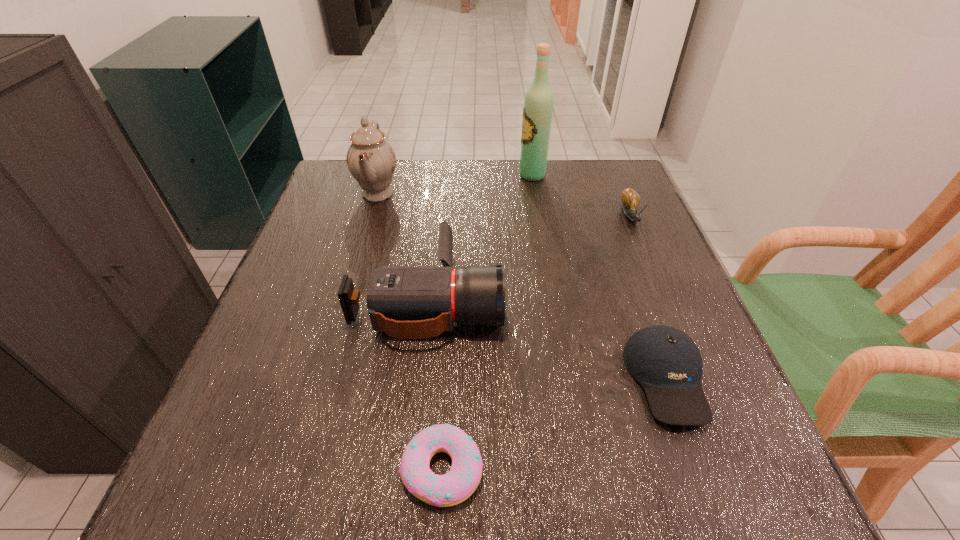
This screenshot has width=960, height=540. What are the coordinates of `the fourth object from left to right` in the screenshot? It's located at tap(538, 105).

This screenshot has height=540, width=960. Find the location of `wine bottle`. wine bottle is located at coordinates (538, 105).

Where is `the fifth shortest object`? The height and width of the screenshot is (540, 960). the fifth shortest object is located at coordinates (371, 160).

Locate an element on the screen. the fourth shortest object is located at coordinates (406, 302).

The image size is (960, 540). Identify the location of baseball cap. (667, 363).

Identify the location of escargot. 630,198.

Locate an element on the screen. This screenshot has height=540, width=960. doughnut is located at coordinates (454, 487).

You are a GUI agent. You are given a task and a screenshot of the screen. Output one action in this format:
    pyautogui.click(x=<x>, y=<y>)
    Task: Click on the vacant point located 0.360m on the front-facing side of the third object from right to left
    The image size is (960, 540).
    Given the screenshot: What is the action you would take?
    pyautogui.click(x=390, y=176)

Find the location of a particular element. The height and width of the screenshot is (540, 960). vacant region located 0.050m on the front-facing side of the third object from right to left is located at coordinates (501, 176).

You are a GUI agent. You are given a task and a screenshot of the screen. Output one action in this format:
    pyautogui.click(x=<x>, y=<y>)
    Task: Click on the free space located 0.250m on the front-facing side of the third object from right to left
    
    Given the screenshot: What is the action you would take?
    pyautogui.click(x=429, y=176)